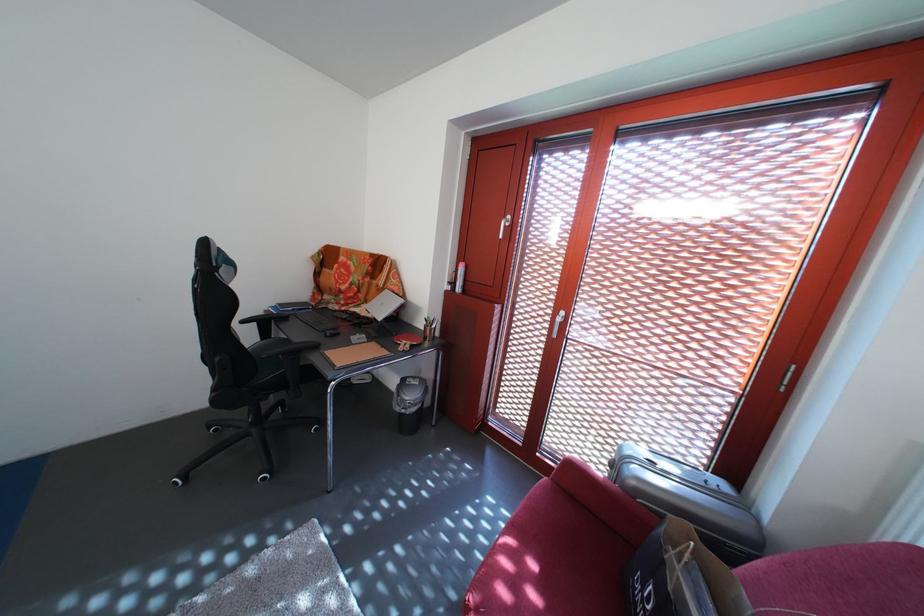
The height and width of the screenshot is (616, 924). What are the coordinates of `red sofa armrest` in the screenshot? It's located at (603, 500).